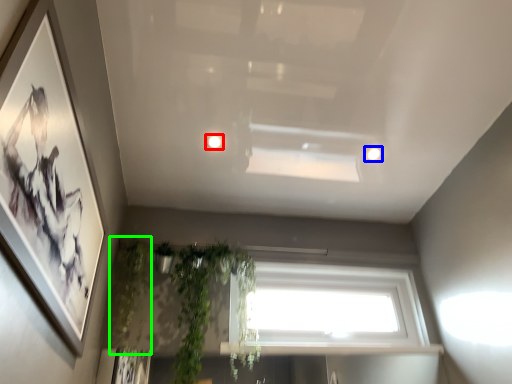
Question: Which object is positioned farthest from lighting (highlighted by a red box)? Select from lighting (highlighted by a blue box) and plant (highlighted by a green box).

Choices:
 (A) lighting
 (B) plant

Answer: (B)